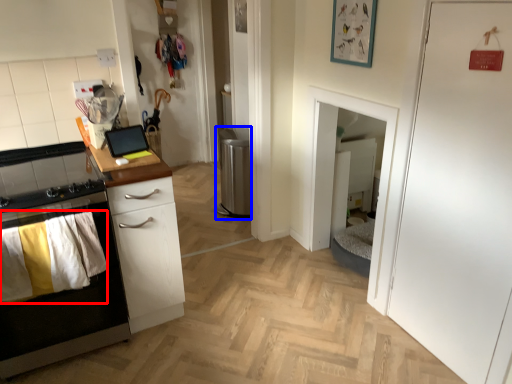
Question: Among these objects, which one is farthest to the camera, laundry (highlighted by a red box) or appliance (highlighted by a blue box)?

Choices:
 (A) laundry
 (B) appliance

Answer: (B)